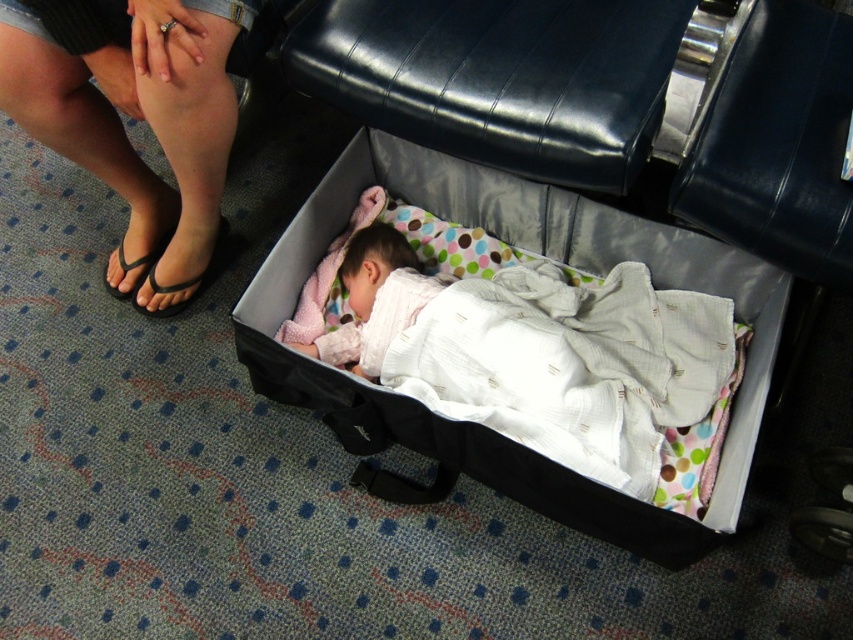
Question: Is white soft fabric baby at center to the right of black rubber sandal at lower left from the viewer's perspective?

Choices:
 (A) no
 (B) yes

Answer: (B)

Question: Estimate the real-world distances between objects in this image. Which object is farther from the black rubber sandal at lower left?

Choices:
 (A) white soft fabric baby at center
 (B) black flip-flop at lower left
 (C) black flip-flops at lower left

Answer: (A)

Question: Is the position of white soft fabric baby at center more distant than that of black flip-flops at lower left?

Choices:
 (A) yes
 (B) no

Answer: (A)

Question: Which of these objects is positioned closest to the black flip-flop at lower left?

Choices:
 (A) white soft fabric baby at center
 (B) black flip-flops at lower left

Answer: (B)

Question: Is black flip-flops at lower left thinner than black rubber sandal at lower left?

Choices:
 (A) no
 (B) yes

Answer: (A)

Question: Estimate the real-world distances between objects in this image. Which object is farther from the black rubber sandal at lower left?

Choices:
 (A) black flip-flops at lower left
 (B) white soft fabric baby at center
 (C) black flip-flop at lower left

Answer: (B)